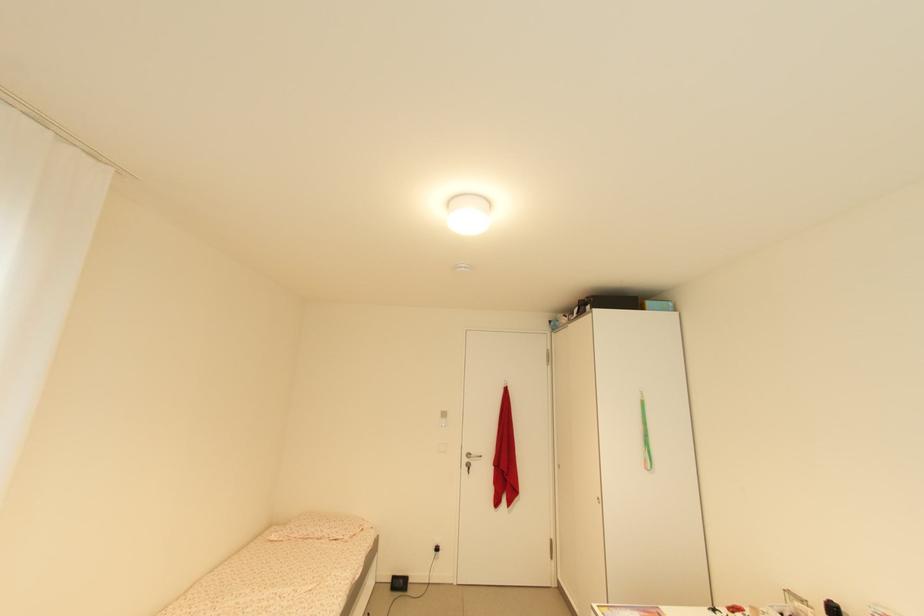
Describe the element at coordinates (472, 456) in the screenshot. I see `the silver door handle` at that location.